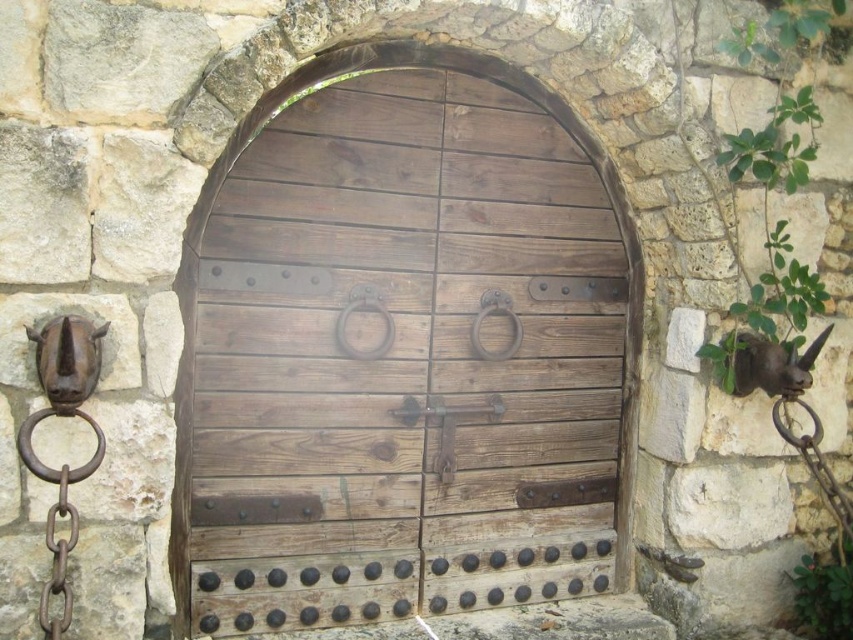
Which is behind, point (335, 301) or point (453, 420)?

The point (453, 420) is more distant.

This screenshot has height=640, width=853. Find the location of `wooden door at center`. wooden door at center is located at coordinates (397, 353).